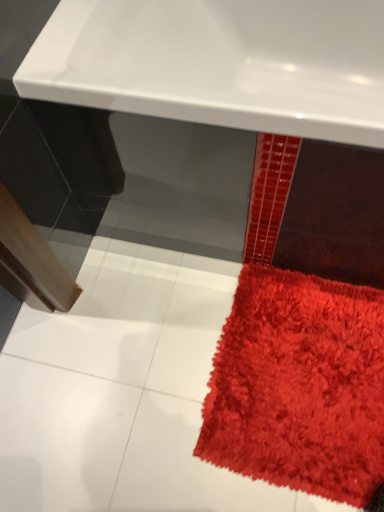
At what (x,y) coordinates should I click in order to perform the action: click on vacant space that is to the left of shaggy red rug at lower right. Please return your answer as a coordinate pair (x, y). Looking at the image, I should click on (141, 377).